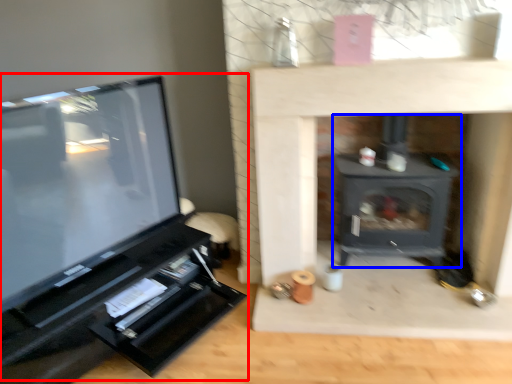
Question: Which point is closer to the camera, entertainment center (highlighted by a red box) or wood burning stove (highlighted by a blue box)?

Choices:
 (A) entertainment center
 (B) wood burning stove

Answer: (A)